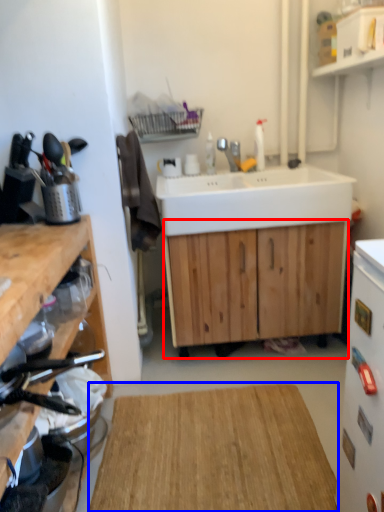
Question: Which of the following is the closest to the observer, cabinetry (highlighted by a red box) or hardwood (highlighted by a blue box)?

Choices:
 (A) cabinetry
 (B) hardwood

Answer: (B)